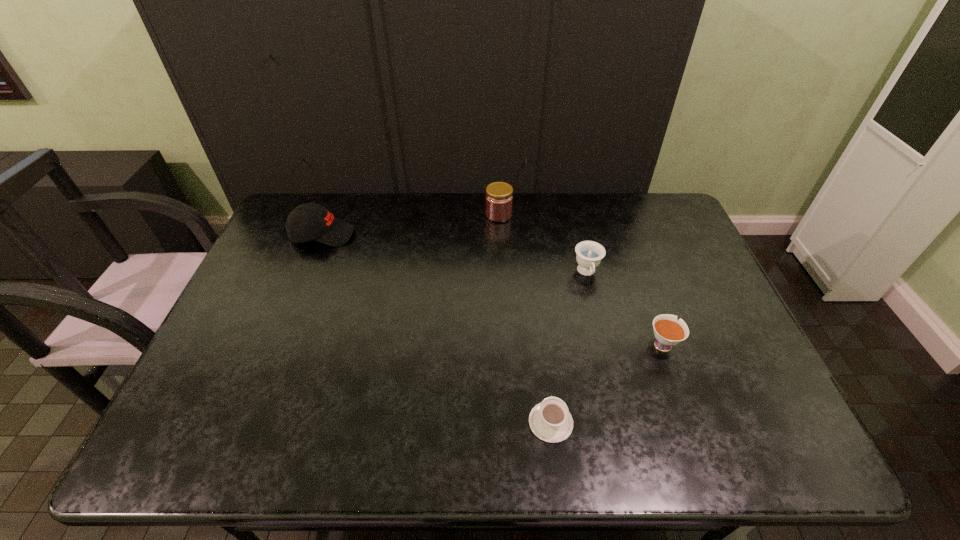
Where is `baseball cap`? This screenshot has width=960, height=540. baseball cap is located at coordinates point(311,221).

Where is `jam`? jam is located at coordinates (499, 198).

Where is `the farthest teacup`? This screenshot has width=960, height=540. the farthest teacup is located at coordinates (589, 253).

Locate an element on the screen. The image size is (960, 540). the second teacup from left to right is located at coordinates (589, 253).

Locate an element on the screen. This screenshot has width=960, height=540. the second nearest object is located at coordinates (668, 332).

Find the location of a particular element. The width and height of the screenshot is (960, 540). the second nearest teacup is located at coordinates (668, 332).

This screenshot has width=960, height=540. In order to click on the leftmost teacup in this screenshot , I will do `click(550, 420)`.

In order to click on the shortest teacup in this screenshot , I will do (x=550, y=420).

At what (x,y) coordinates should I click in order to perform the action: click on vacant space situated on the front-facing side of the baseball cap. Please return your answer as a coordinate pair (x, y). This screenshot has height=540, width=960. Looking at the image, I should click on (430, 234).

You are a GUI agent. You are given a task and a screenshot of the screen. Output one action in this format:
    pyautogui.click(x=<x>, y=<y>)
    Task: Click on the free spot located 0.260m on the right of the jam
    
    Given the screenshot: What is the action you would take?
    588,214